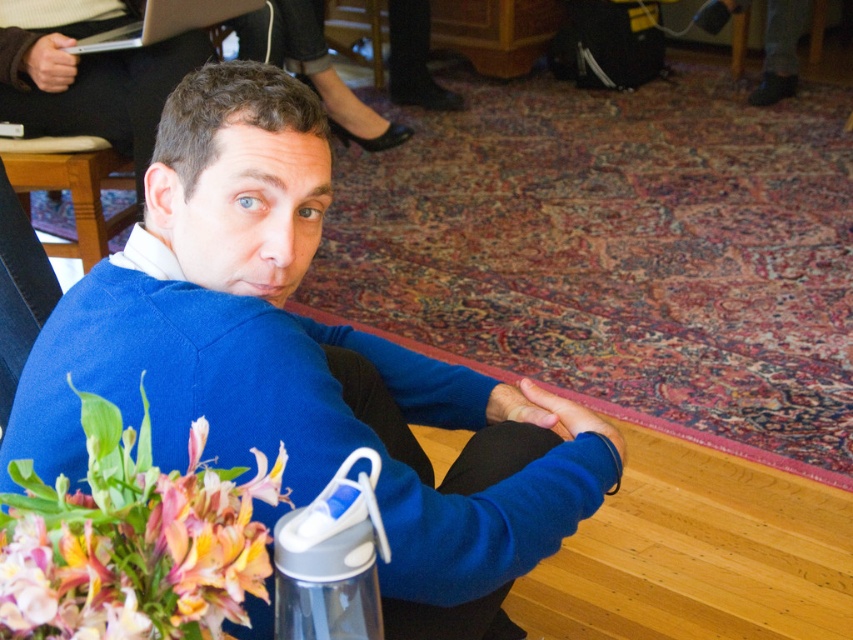
Question: Is blue matte sweater at center closer to the viewer compared to silver metallic laptop at upper left?

Choices:
 (A) no
 (B) yes

Answer: (B)

Question: Which of these objects is positioned farthest from the floral bouquet at lower left?

Choices:
 (A) blue matte sweater at center
 (B) matte black armchair at upper center
 (C) silver metallic laptop at upper left

Answer: (B)

Question: Is the position of black leather armchair at left more distant than that of silver metallic laptop at upper left?

Choices:
 (A) no
 (B) yes

Answer: (B)

Question: Is blue matte sweater at center to the left of black leather armchair at left from the viewer's perspective?

Choices:
 (A) yes
 (B) no

Answer: (B)

Question: Estimate the real-world distances between objects in this image. Which object is closer to the blue matte sweater at center?

Choices:
 (A) matte black armchair at upper center
 (B) black leather armchair at left
 (C) floral bouquet at lower left
 (D) silver metallic laptop at upper left

Answer: (C)

Question: Based on their relative distances, which object is farther from the black leather armchair at left?

Choices:
 (A) blue matte sweater at center
 (B) floral bouquet at lower left

Answer: (B)